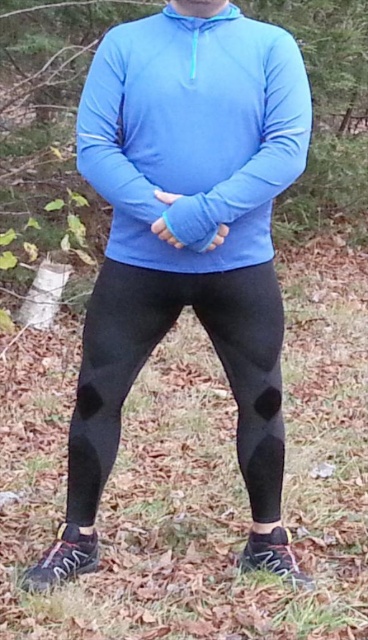
You are a fashion designer observing the autumn forest scene. You need to determine which clothing item, the matte blue sweatshirt at center or the black mesh leggings at center, reaches lower on the body. Which one is it?

The black mesh leggings at center reach lower on the body because the matte blue sweatshirt at center is shorter than the black mesh leggings at center.

You are navigating a virtual forest scene and need to locate the matte blue sweatshirt at center. According to the coordinates provided, where exactly would you find it in relation to the person?

The matte blue sweatshirt at center is located at point coordinates 0.212 on the x axis and 0.527 on the y axis, which places it centrally in the image.